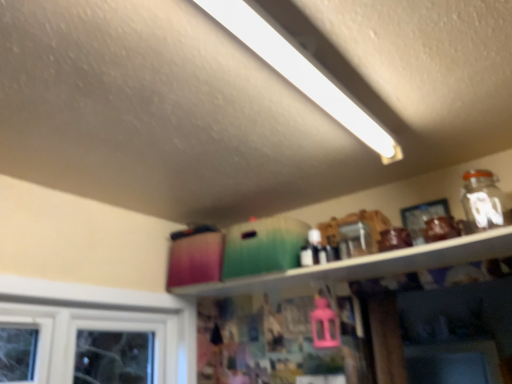
Question: Is white fluorescent tube at upper center wider or thinner than matte green container at upper center?

Choices:
 (A) thin
 (B) wide

Answer: (B)

Question: In terms of size, does white fluorescent tube at upper center appear bigger or smaller than matte green container at upper center?

Choices:
 (A) small
 (B) big

Answer: (B)

Question: Based on their positions, is white fluorescent tube at upper center located to the left or right of matte green container at upper center?

Choices:
 (A) right
 (B) left

Answer: (B)

Question: Considering the positions of point (209, 296) and point (357, 129), is point (209, 296) closer or farther from the camera than point (357, 129)?

Choices:
 (A) farther
 (B) closer

Answer: (A)

Question: Is matte green container at upper center to the left or to the right of white fluorescent tube at upper center in the image?

Choices:
 (A) left
 (B) right

Answer: (B)

Question: Is matte green container at upper center in front of or behind white fluorescent tube at upper center in the image?

Choices:
 (A) front
 (B) behind

Answer: (B)

Question: From a real-world perspective, is matte green container at upper center positioned above or below white fluorescent tube at upper center?

Choices:
 (A) below
 (B) above

Answer: (A)